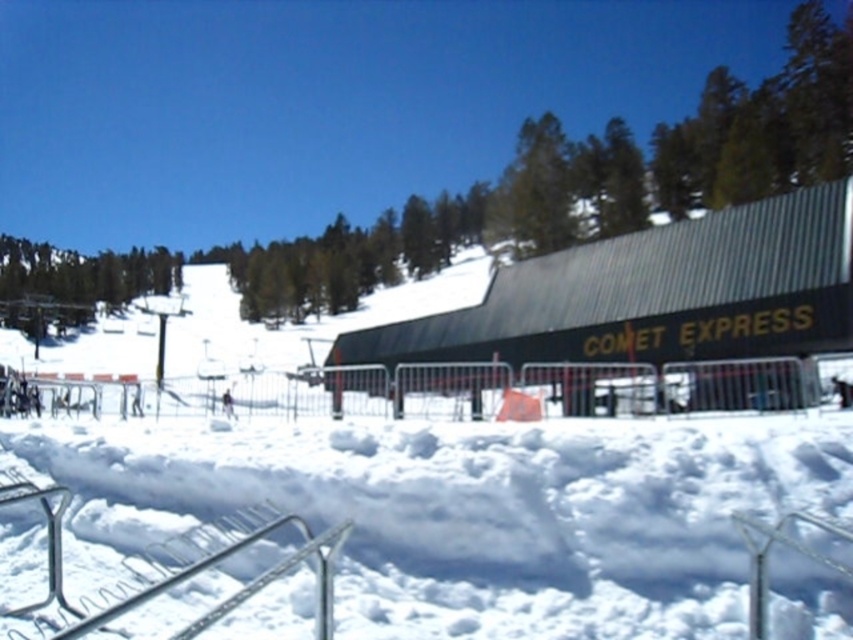
Question: Which point appears farthest from the camera in this image?

Choices:
 (A) (659, 353)
 (B) (756, 513)
 (C) (308, 536)

Answer: (A)

Question: From the image, what is the correct spatial relationship of metallic gray building at center-right in relation to metallic silver rail at lower center?

Choices:
 (A) left
 (B) right

Answer: (B)

Question: Is white fluffy snow at lower center smaller than metallic gray building at center-right?

Choices:
 (A) no
 (B) yes

Answer: (B)

Question: Estimate the real-world distances between objects in this image. Which object is farther from the metallic silver rail at lower center?

Choices:
 (A) white fluffy snow at lower center
 (B) metallic gray building at center-right

Answer: (B)

Question: Does metallic gray building at center-right appear on the right side of metallic silver rail at lower center?

Choices:
 (A) no
 (B) yes

Answer: (B)

Question: Which of the following is the closest to the observer?

Choices:
 (A) metallic silver rail at lower center
 (B) metallic gray building at center-right
 (C) white fluffy snow at lower center

Answer: (C)